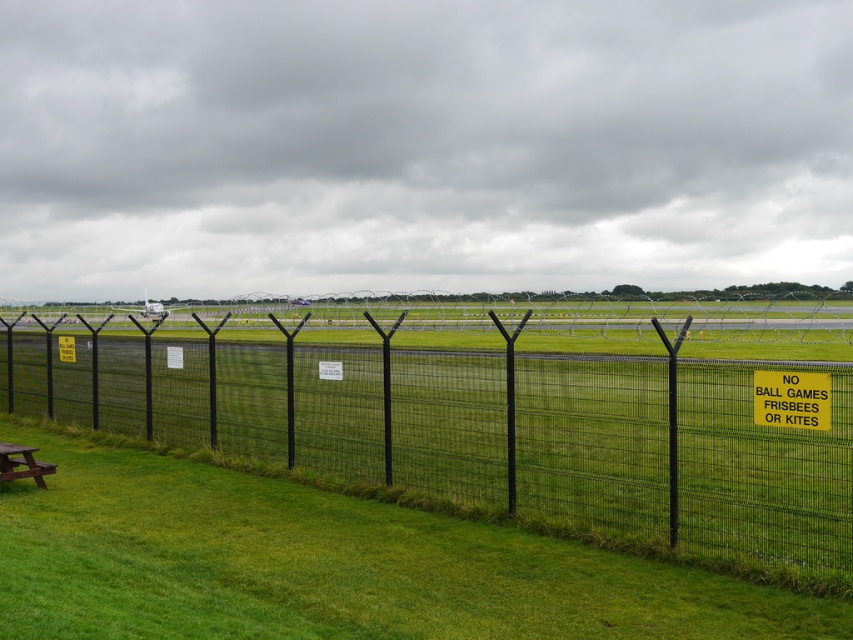
You are a park ranger inspecting the area. You notice the black wire mesh fence at center and the yellow plastic sign at center right. Which object is closer to the ground?

The black wire mesh fence at center is positioned under the yellow plastic sign at center right, so it is closer to the ground.

You are standing at the edge of the runway and want to walk to the brown wooden picnic table at lower left. Is the black wire mesh fence at center blocking your path?

The black wire mesh fence at center is in front of the brown wooden picnic table at lower left, so it would block your path to the picnic table.

You are planning to place a new bench that is 2 meters wide in the grassy area. The yellow plastic sign at center right and the brown wooden picnic table at lower left are already there. Which existing object can the bench fit next to without overlapping?

The bench that is 2 meters wide can fit next to the brown wooden picnic table at lower left because the yellow plastic sign at center right is narrower than the picnic table, so the picnic table likely has more space available next to it.